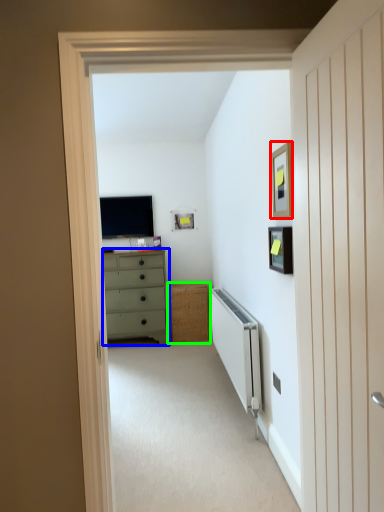
Question: Based on their relative distances, which object is farther from picture frame (highlighted by a red box)? Choose from chest of drawers (highlighted by a blue box) and cabinetry (highlighted by a green box).

Choices:
 (A) chest of drawers
 (B) cabinetry

Answer: (B)